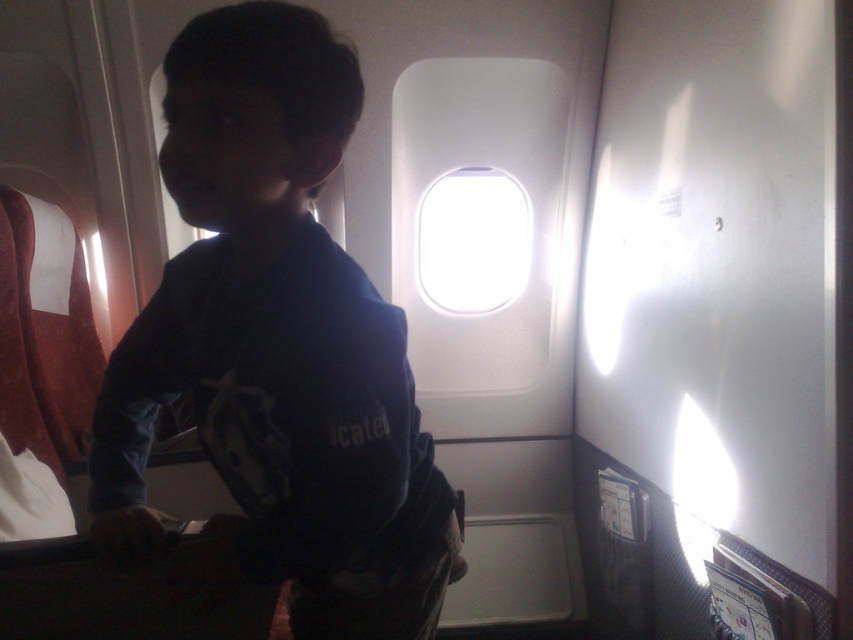
You are sitting in an airplane seat and see two points in the cabin, one at point (320, 516) and the other at point (428, 205). Which point is closer to you?

Point (320, 516) is closer to the viewer than point (428, 205).

You are a flight attendant checking the cabin and notice the dark blue shirt at center and the transparent glass airplane window at center. Which object is closer to the floor?

The dark blue shirt at center is located below the transparent glass airplane window at center, so it is closer to the floor than the window.